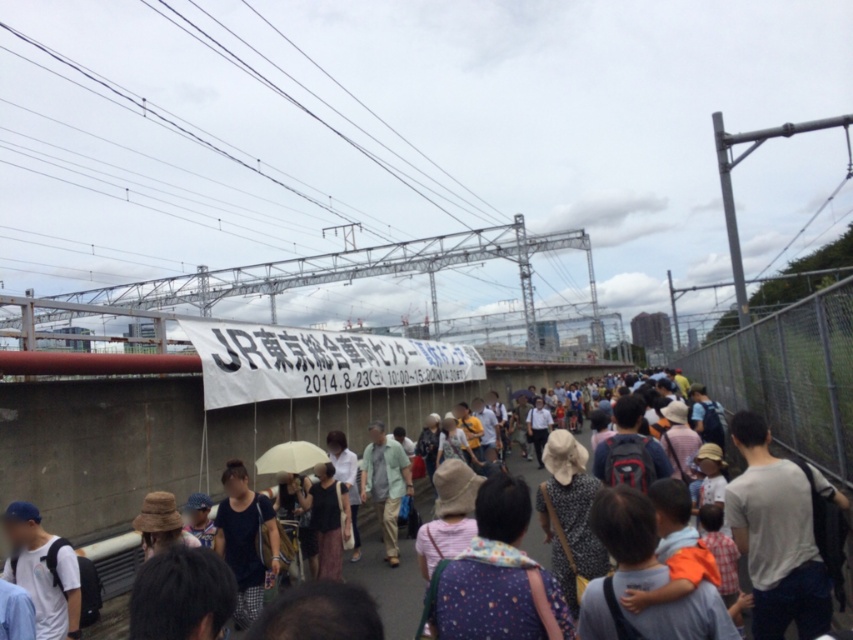
You are standing in the crowd at the event and want to take a photo of the white wire at upper center without any obstructions. Considering the distance, is it feasible to take this photo from your current position?

The white wire at upper center is 8.06 meters away from viewer, so it is feasible to take a photo of the white wire at upper center from your current position as the distance is manageable and unlikely to cause obstruction issues.

In the scene shown: You are standing at the center of the pathway in the crowd. You want to reach the beige matte umbrella at center without moving your current position. Is the light green fabric shirt at center blocking your path? Please explain your reasoning.

The light green fabric shirt at center is 6.15 feet away from the beige matte umbrella at center. Since they are both at the center, the shirt is positioned between you and the umbrella, so it is blocking your path.